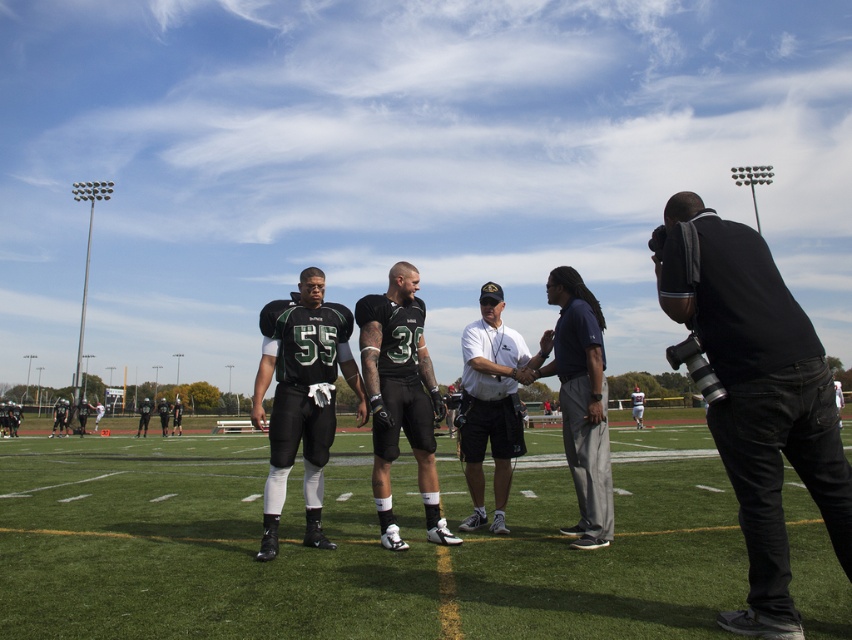
Is point (447, 532) closer to viewer compared to point (502, 513)?

Yes, it is in front of point (502, 513).

Can you confirm if black matte football uniforms at center is positioned below white shirt at center?

No.

Who is more forward, (410, 339) or (462, 372)?

Point (410, 339) is in front.

Identify the location of black matte football uniforms at center. (398, 380).

Is point (306, 422) more distant than point (422, 467)?

No, it is in front of (422, 467).

Who is shorter, matte black football uniform at center or black matte uniform at center?

matte black football uniform at center

What do you see at coordinates (302, 397) in the screenshot? I see `matte black football uniform at center` at bounding box center [302, 397].

You are a GUI agent. You are given a task and a screenshot of the screen. Output one action in this format:
    pyautogui.click(x=<x>, y=<y>)
    Task: Click on the matte black football uniform at center
    
    Given the screenshot: What is the action you would take?
    pyautogui.click(x=302, y=397)

Is black matte football uniforms at center thinner than matte black football uniform at center?

In fact, black matte football uniforms at center might be wider than matte black football uniform at center.

Between black matte football uniforms at center and matte black football uniform at center, which one has more height?

black matte football uniforms at center

Between point (426, 416) and point (297, 381), which one is positioned in front?

Point (297, 381)

The image size is (852, 640). Find the location of `black matte football uniforms at center`. black matte football uniforms at center is located at coordinates (398, 380).